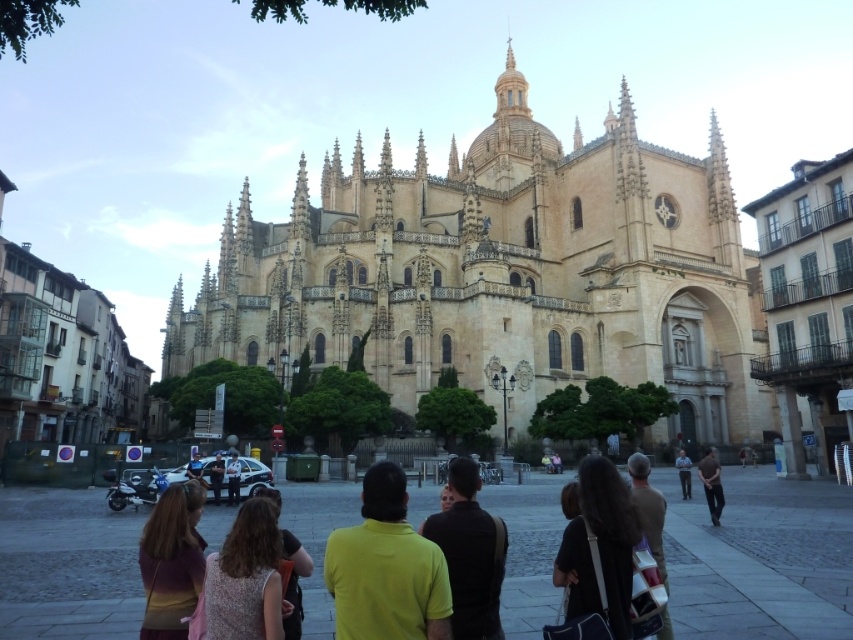
Between yellow matte shirt at center and dark blue uniform at center, which one is positioned higher?

yellow matte shirt at center

Between point (428, 580) and point (686, 474), which one is positioned behind?

Positioned behind is point (686, 474).

Is point (376, 493) behind point (688, 467)?

No.

The height and width of the screenshot is (640, 853). Identify the location of yellow matte shirt at center. (386, 568).

Does point (390, 554) lie behind point (585, 502)?

No, (390, 554) is in front of (585, 502).

This screenshot has height=640, width=853. What are the coordinates of `yellow matte shirt at center` in the screenshot? It's located at (386, 568).

Is point (367, 588) closer to camera compared to point (590, 605)?

Yes, point (367, 588) is in front of point (590, 605).

Locate an element on the screen. This screenshot has width=853, height=640. yellow matte shirt at center is located at coordinates (386, 568).

Can you confirm if light brown leather jacket at center is positioned above dark blue uniform at center?

Yes.

Which is below, light brown leather jacket at center or dark blue uniform at center?

dark blue uniform at center is lower down.

Is point (231, 468) positioned before point (682, 451)?

Yes, it is.

This screenshot has height=640, width=853. What are the coordinates of `light brown leather jacket at center` in the screenshot? It's located at (233, 480).